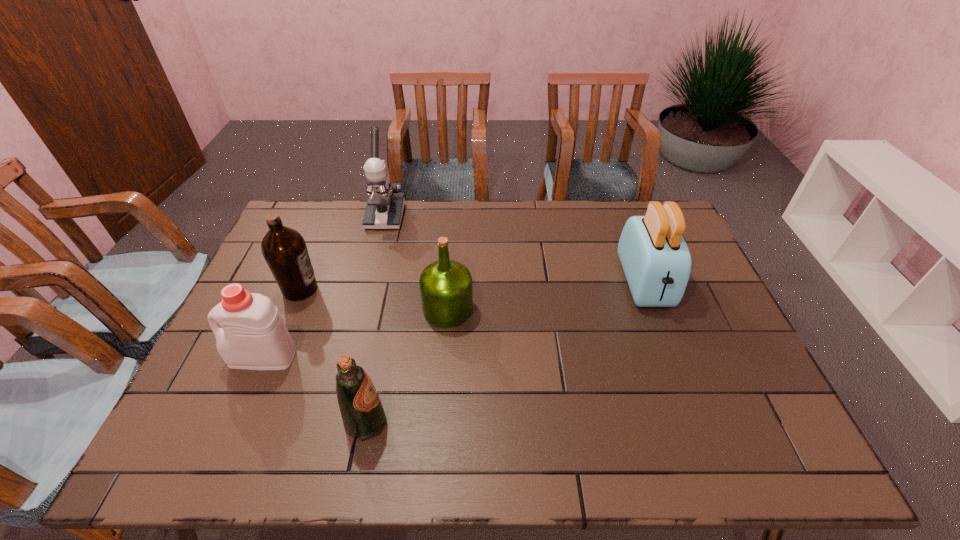
The height and width of the screenshot is (540, 960). Identify the location of vacant space at the far left corner. (305, 215).

In the image, there is a desktop. Identify the location of free space at the far right corner. The height and width of the screenshot is (540, 960). (637, 214).

I want to click on free point between the second object from right to left and the nearest olive oil, so click(407, 365).

Locate an element on the screen. Image resolution: width=960 pixels, height=540 pixels. free spot between the detergent and the second object from right to left is located at coordinates (355, 333).

You are a GUI agent. You are given a task and a screenshot of the screen. Output one action in this format:
    pyautogui.click(x=<x>, y=<y>)
    Task: Click on the free point between the rightmost olive oil and the leftmost olive oil
    The height and width of the screenshot is (540, 960).
    Given the screenshot: What is the action you would take?
    coord(374,299)

Identify the location of free space between the rightmost olive oil and the leftmost olive oil. Image resolution: width=960 pixels, height=540 pixels. (374, 299).

Locate an element on the screen. This screenshot has height=540, width=960. unoccupied area between the rightmost olive oil and the leftmost olive oil is located at coordinates (374, 299).

Find the location of `vacant area that lies between the nearest object and the second nearest object`. vacant area that lies between the nearest object and the second nearest object is located at coordinates (314, 389).

Find the location of `free space between the leftmost olive oil and the nearest object`. free space between the leftmost olive oil and the nearest object is located at coordinates (333, 355).

Locate an element on the screen. The height and width of the screenshot is (540, 960). free area in between the farthest object and the leftmost olive oil is located at coordinates (343, 253).